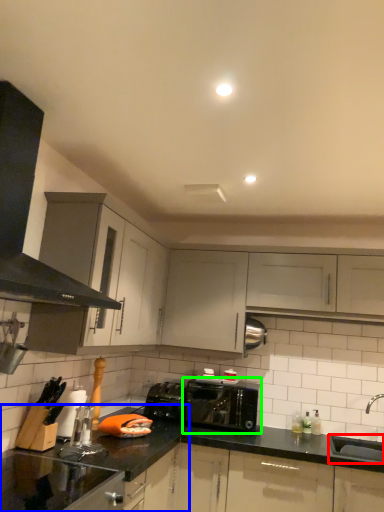
Question: Which object is the farthest from sink (highlighted by a red box)? Choose among these: countertop (highlighted by a blue box) or toaster (highlighted by a green box).

Choices:
 (A) countertop
 (B) toaster

Answer: (A)